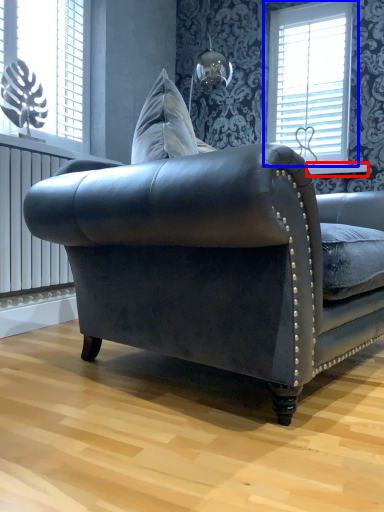
Question: Which object appears closest to the camera in this image, window sill (highlighted by a red box) or window (highlighted by a blue box)?

Choices:
 (A) window sill
 (B) window

Answer: (A)